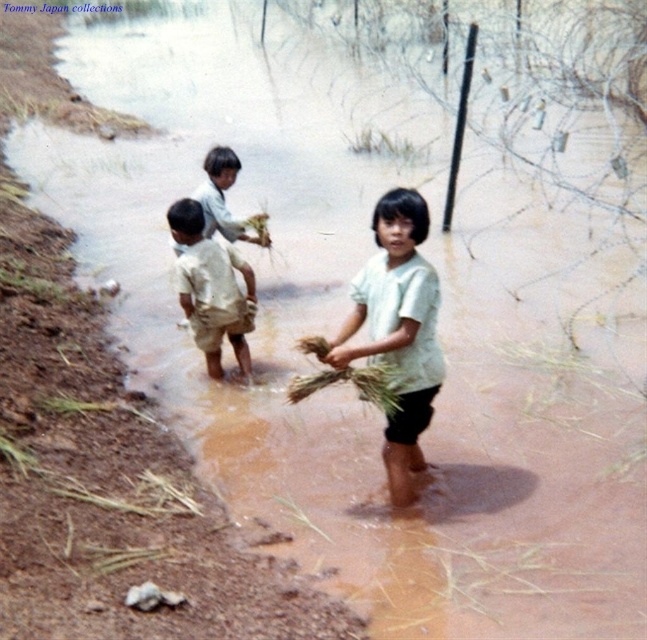
Between light beige cotton shirt at center and light beige shorts at center, which one appears on the right side from the viewer's perspective?

light beige cotton shirt at center is more to the right.

Does point (411, 189) lie behind point (201, 232)?

No, it is in front of (201, 232).

This screenshot has height=640, width=647. I want to click on light beige cotton shirt at center, so click(399, 332).